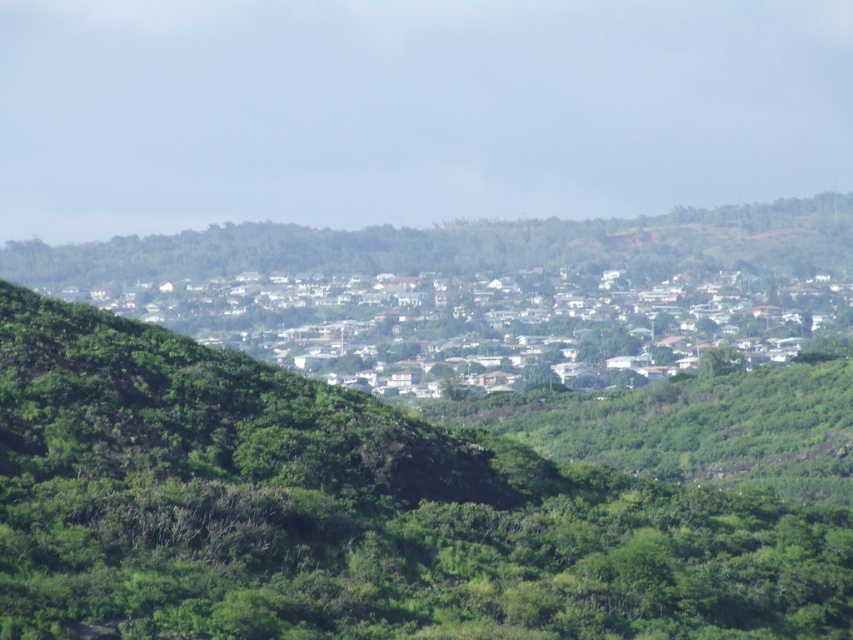
Question: Is green leafy tree at center to the left of white matte houses at center from the viewer's perspective?

Choices:
 (A) no
 (B) yes

Answer: (B)

Question: Can you confirm if green leafy tree at center is thinner than white matte houses at center?

Choices:
 (A) yes
 (B) no

Answer: (A)

Question: Is green leafy tree at center positioned behind white matte houses at center?

Choices:
 (A) yes
 (B) no

Answer: (B)